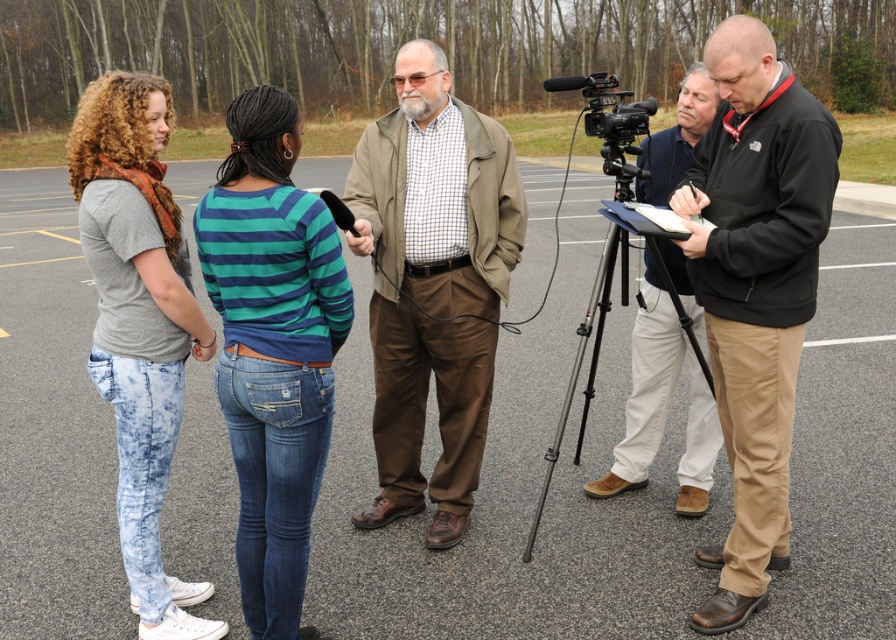
Between brown cotton pants at center and light blue faded jeans at left, which one has less height?

With less height is light blue faded jeans at left.

Who is higher up, brown cotton pants at center or light blue faded jeans at left?

Positioned higher is brown cotton pants at center.

Between point (395, 353) and point (148, 77), which one is positioned in front?

Point (148, 77) is more forward.

Where is `brown cotton pants at center`? The width and height of the screenshot is (896, 640). brown cotton pants at center is located at coordinates (432, 284).

Between light blue faded jeans at left and black plastic video camera at right, which one has less height?

With less height is light blue faded jeans at left.

Does light blue faded jeans at left have a lesser width compared to black plastic video camera at right?

Correct, light blue faded jeans at left's width is less than black plastic video camera at right's.

You are a GUI agent. You are given a task and a screenshot of the screen. Output one action in this format:
    pyautogui.click(x=<x>, y=<y>)
    Task: Click on the light blue faded jeans at left
    
    Given the screenshot: What is the action you would take?
    pyautogui.click(x=139, y=323)

Is brown cotton pants at center smaller than black softshell jacket at right?

Incorrect, brown cotton pants at center is not smaller in size than black softshell jacket at right.

Does brown cotton pants at center have a lesser height compared to black softshell jacket at right?

Correct, brown cotton pants at center is not as tall as black softshell jacket at right.

This screenshot has height=640, width=896. Describe the element at coordinates (432, 284) in the screenshot. I see `brown cotton pants at center` at that location.

Locate an element on the screen. brown cotton pants at center is located at coordinates (432, 284).